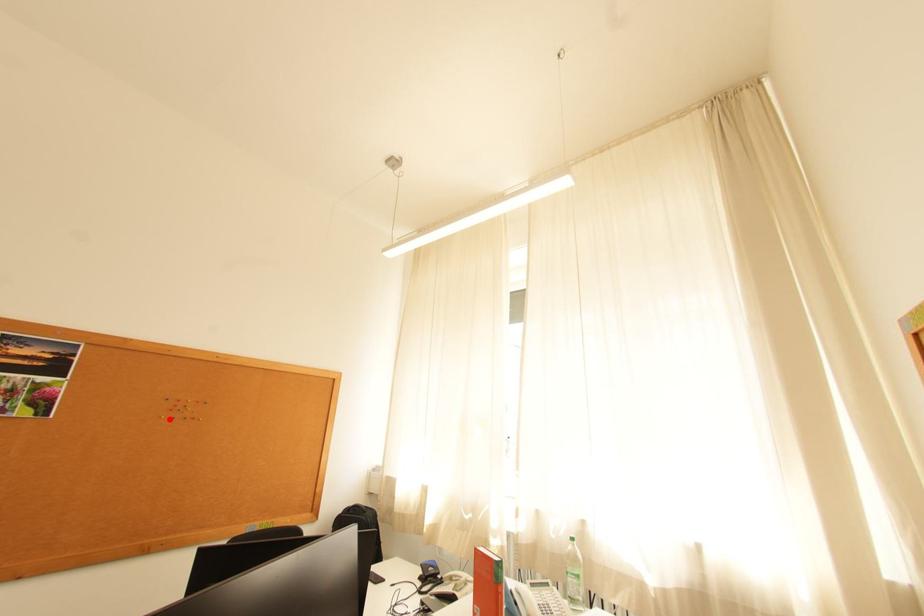
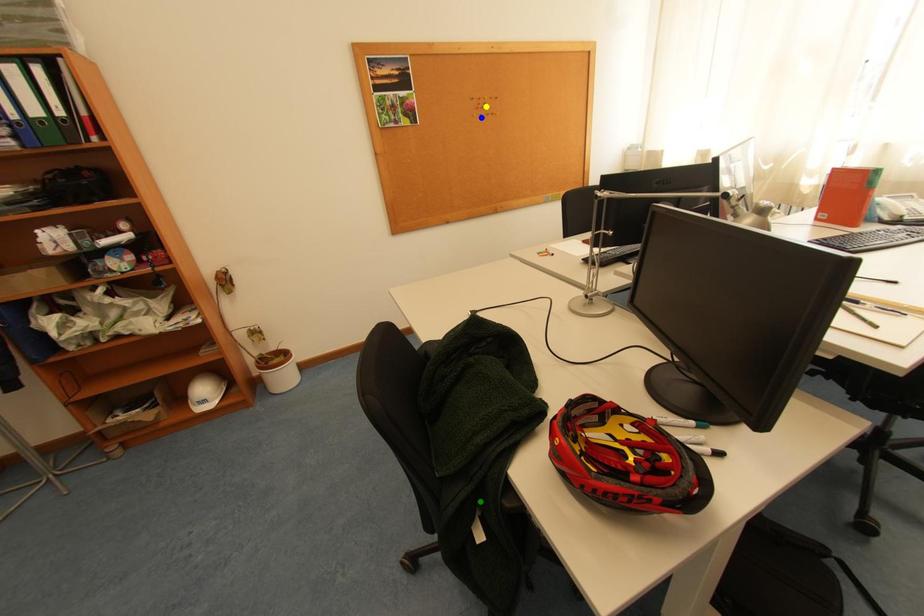
Question: I am providing you with two images of the same scene from different viewpoints. A red point is marked on the first image. You are given multiple points on the second image. Can you choose the point in image 2 that corresponds to the point in image 1?

Choices:
 (A) blue point
 (B) green point
 (C) yellow point

Answer: (A)